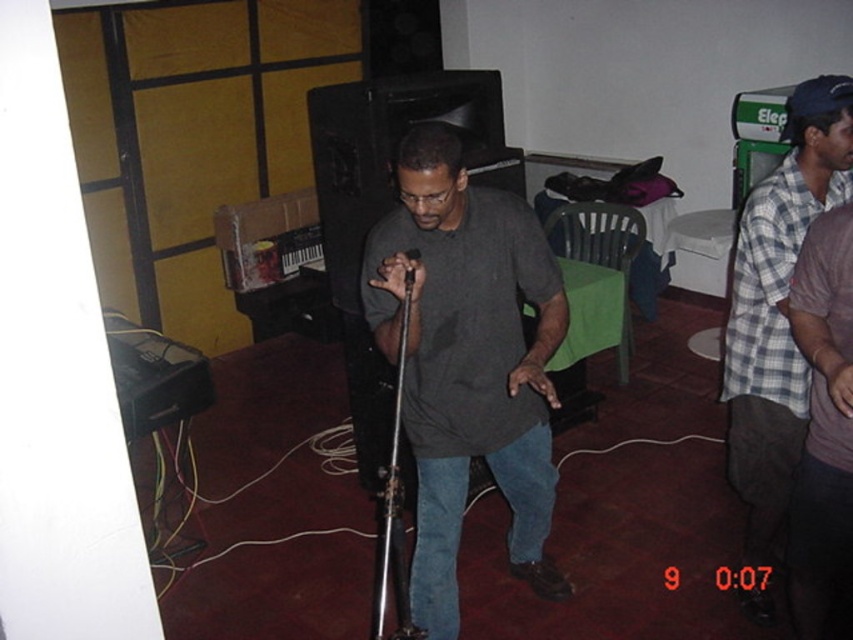
Does dark gray matte shirt at center appear on the left side of plaid shirt at right?

Yes, dark gray matte shirt at center is to the left of plaid shirt at right.

Is dark gray matte shirt at center further to camera compared to plaid shirt at right?

No, dark gray matte shirt at center is closer to the viewer.

Where is `dark gray matte shirt at center`? The width and height of the screenshot is (853, 640). dark gray matte shirt at center is located at coordinates (467, 362).

Between dark gray matte shirt at center and purple cotton shirt at right, which one has less height?

purple cotton shirt at right

Is dark gray matte shirt at center to the right of purple cotton shirt at right from the viewer's perspective?

Incorrect, dark gray matte shirt at center is not on the right side of purple cotton shirt at right.

Is point (434, 280) farther from camera compared to point (830, 438)?

Yes.

Locate an element on the screen. Image resolution: width=853 pixels, height=640 pixels. dark gray matte shirt at center is located at coordinates (467, 362).

Is plaid shirt at right positioned in front of purple cotton shirt at right?

That is False.

Can you confirm if plaid shirt at right is bigger than purple cotton shirt at right?

Yes.

You are a GUI agent. You are given a task and a screenshot of the screen. Output one action in this format:
    pyautogui.click(x=<x>, y=<y>)
    Task: Click on the plaid shirt at right
    Image resolution: width=853 pixels, height=640 pixels.
    Given the screenshot: What is the action you would take?
    pyautogui.click(x=778, y=305)